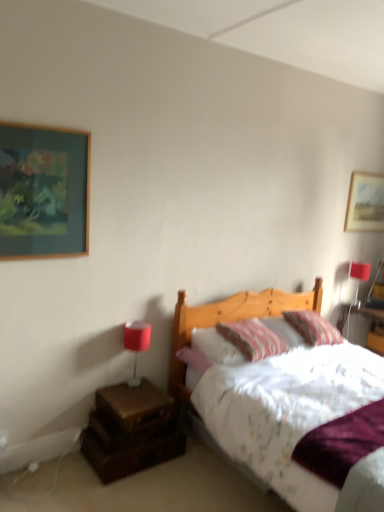
Find the location of `matte red lampshade at upper right, the 2th table lamp in the bottom-to-top sequence`. matte red lampshade at upper right, the 2th table lamp in the bottom-to-top sequence is located at coordinates (358, 278).

What do you see at coordinates (358, 278) in the screenshot?
I see `matte red lampshade at upper right, which is the 1th table lamp in top-to-bottom order` at bounding box center [358, 278].

Describe the element at coordinates (3, 439) in the screenshot. This screenshot has width=384, height=512. I see `white plastic electric outlet at lower left` at that location.

Find the location of a particular element. striped fabric pillow at center, marked as the 1th pillow in a left-to-right arrangement is located at coordinates (253, 339).

What do you see at coordinates (131, 430) in the screenshot?
I see `brown wooden nightstand at lower left` at bounding box center [131, 430].

The image size is (384, 512). Describe the element at coordinates (313, 328) in the screenshot. I see `striped fabric pillow at upper right, acting as the 1th pillow starting from the right` at that location.

What are the coordinates of `wooden picture frame at upper right, which ranks as the 2th picture frame in left-to-right order` in the screenshot? It's located at (365, 203).

Measure the distance between wooden picture frame at upper right, which ranks as the 2th picture frame in left-to-right order, and white plastic electric outlet at lower left.

wooden picture frame at upper right, which ranks as the 2th picture frame in left-to-right order, and white plastic electric outlet at lower left are 3.45 meters apart from each other.

Visually, is wooden picture frame at upper right, which is counted as the 1th picture frame, starting from the right, positioned to the left or to the right of white plastic electric outlet at lower left?

Clearly, wooden picture frame at upper right, which is counted as the 1th picture frame, starting from the right, is on the right of white plastic electric outlet at lower left in the image.

Considering the relative positions of wooden picture frame at upper right, the second picture frame from the front, and white plastic electric outlet at lower left in the image provided, is wooden picture frame at upper right, the second picture frame from the front, in front of white plastic electric outlet at lower left?

That is False.

From a real-world perspective, is wooden picture frame at upper right, which is counted as the 1th picture frame, starting from the right, physically located above or below white plastic electric outlet at lower left?

wooden picture frame at upper right, which is counted as the 1th picture frame, starting from the right, is situated higher than white plastic electric outlet at lower left in the real world.

Is wooden picture frame at upper left, the 1th picture frame positioned from the front, facing away from matte red table lamp at left, the 1th table lamp viewed from the front?

That's not correct — wooden picture frame at upper left, the 1th picture frame positioned from the front, is not looking away from matte red table lamp at left, the 1th table lamp viewed from the front.

This screenshot has width=384, height=512. There is a wooden picture frame at upper left, the 1th picture frame in the left-to-right sequence. Identify the location of the 2nd table lamp below it (from a real-world perspective). (136, 344).

How many degrees apart are the facing directions of wooden picture frame at upper left, the 1th picture frame positioned from the front, and matte red table lamp at left, the 2th table lamp viewed from the right?

There is a 0.531-degree angle between the facing directions of wooden picture frame at upper left, the 1th picture frame positioned from the front, and matte red table lamp at left, the 2th table lamp viewed from the right.

From a real-world perspective, is matte red lampshade at upper right, placed as the 1th table lamp when sorted from right to left, above or below matte red table lamp at left, the 1th table lamp viewed from the front?

Clearly, from a real-world perspective, matte red lampshade at upper right, placed as the 1th table lamp when sorted from right to left, is above matte red table lamp at left, the 1th table lamp viewed from the front.

Would you say matte red lampshade at upper right, which is the 1th table lamp in top-to-bottom order, is to the left or to the right of matte red table lamp at left, the 2th table lamp viewed from the right, in the picture?

From the image, it's evident that matte red lampshade at upper right, which is the 1th table lamp in top-to-bottom order, is to the right of matte red table lamp at left, the 2th table lamp viewed from the right.

Considering the sizes of objects wooden picture frame at upper left, which is the 2th picture frame from right to left, and wooden picture frame at upper right, which is the first picture frame in back-to-front order, in the image provided, who is taller, wooden picture frame at upper left, which is the 2th picture frame from right to left, or wooden picture frame at upper right, which is the first picture frame in back-to-front order,?

wooden picture frame at upper left, which is the 2th picture frame from right to left, is taller.

Consider the image. Which of these two, wooden picture frame at upper left, the 1th picture frame positioned from the front, or wooden picture frame at upper right, which is counted as the 1th picture frame, starting from the right, is bigger?

wooden picture frame at upper right, which is counted as the 1th picture frame, starting from the right, is bigger.

Is wooden picture frame at upper left, the 1th picture frame in the left-to-right sequence, further to camera compared to wooden picture frame at upper right, which is the first picture frame in back-to-front order?

No, the depth of wooden picture frame at upper left, the 1th picture frame in the left-to-right sequence, is less than that of wooden picture frame at upper right, which is the first picture frame in back-to-front order.

From the image's perspective, does wooden picture frame at upper left, which is the 2th picture frame from right to left, appear higher than wooden picture frame at upper right, which is counted as the 1th picture frame, starting from the right?

Actually, wooden picture frame at upper left, which is the 2th picture frame from right to left, appears below wooden picture frame at upper right, which is counted as the 1th picture frame, starting from the right, in the image.

Between matte red lampshade at upper right, the second table lamp viewed from the front, and striped fabric pillow at center, marked as the 1th pillow in a left-to-right arrangement, which one has less height?

striped fabric pillow at center, marked as the 1th pillow in a left-to-right arrangement, is shorter.

Visually, is matte red lampshade at upper right, the 2th table lamp in the bottom-to-top sequence, positioned to the left or to the right of striped fabric pillow at center, which appears as the second pillow when viewed from the right?

matte red lampshade at upper right, the 2th table lamp in the bottom-to-top sequence, is positioned on striped fabric pillow at center, which appears as the second pillow when viewed from the right,'s right side.

Does matte red lampshade at upper right, the 1th table lamp in the back-to-front sequence, turn towards striped fabric pillow at center, which appears as the second pillow when viewed from the right?

No, matte red lampshade at upper right, the 1th table lamp in the back-to-front sequence, is not facing towards striped fabric pillow at center, which appears as the second pillow when viewed from the right.

Where is `table lamp above the striped fabric pillow at center, which appears as the second pillow when viewed from the right (from the image's perspective)`? table lamp above the striped fabric pillow at center, which appears as the second pillow when viewed from the right (from the image's perspective) is located at coordinates (358, 278).

Would you consider brown wooden nightstand at lower left to be distant from matte red table lamp at left, which appears as the second table lamp when viewed from the back?

brown wooden nightstand at lower left is near matte red table lamp at left, which appears as the second table lamp when viewed from the back, not far away.

Can you confirm if brown wooden nightstand at lower left is wider than matte red table lamp at left, the 1th table lamp viewed from the front?

Indeed, brown wooden nightstand at lower left has a greater width compared to matte red table lamp at left, the 1th table lamp viewed from the front.

Considering the positions of objects brown wooden nightstand at lower left and matte red table lamp at left, which appears as the second table lamp when viewed from the back, in the image provided, who is more to the right, brown wooden nightstand at lower left or matte red table lamp at left, which appears as the second table lamp when viewed from the back,?

From the viewer's perspective, matte red table lamp at left, which appears as the second table lamp when viewed from the back, appears more on the right side.

From a real-world perspective, does striped fabric pillow at center, marked as the 1th pillow in a left-to-right arrangement, stand above brown wooden nightstand at lower left?

Yes.

Considering the points (283, 350) and (147, 388), which point is behind, point (283, 350) or point (147, 388)?

The point (283, 350) is more distant.

Where is `nightstand located underneath the striped fabric pillow at center, marked as the 1th pillow in a left-to-right arrangement (from a real-world perspective)`? The width and height of the screenshot is (384, 512). nightstand located underneath the striped fabric pillow at center, marked as the 1th pillow in a left-to-right arrangement (from a real-world perspective) is located at coordinates (131, 430).

Is striped fabric pillow at center, which appears as the second pillow when viewed from the right, looking in the opposite direction of brown wooden nightstand at lower left?

No.

Locate an element on the screen. Image resolution: width=384 pixels, height=512 pixels. picture frame that is behind the white plastic electric outlet at lower left is located at coordinates (365, 203).

The width and height of the screenshot is (384, 512). What are the coordinates of `picture frame in front of the matte red table lamp at left, positioned as the 1th table lamp in bottom-to-top order` in the screenshot? It's located at (43, 191).

Estimate the real-world distances between objects in this image. Which object is further from brown wooden nightstand at lower left, matte red table lamp at left, positioned as the 1th table lamp in bottom-to-top order, or white plastic electric outlet at lower left?

white plastic electric outlet at lower left is positioned further to the anchor brown wooden nightstand at lower left.

Estimate the real-world distances between objects in this image. Which object is closer to striped fabric pillow at center, which appears as the second pillow when viewed from the right, wooden picture frame at upper right, which ranks as the 2th picture frame in left-to-right order, or matte red table lamp at left, the 2th table lamp viewed from the right?

Based on the image, matte red table lamp at left, the 2th table lamp viewed from the right, appears to be nearer to striped fabric pillow at center, which appears as the second pillow when viewed from the right.

Based on the photo, based on their spatial positions, is striped fabric pillow at upper right, the second pillow positioned from the left, or matte red lampshade at upper right, placed as the 1th table lamp when sorted from right to left, closer to striped fabric pillow at center, which appears as the second pillow when viewed from the right?

striped fabric pillow at upper right, the second pillow positioned from the left, is closer to striped fabric pillow at center, which appears as the second pillow when viewed from the right.

Estimate the real-world distances between objects in this image. Which object is closer to brown wooden nightstand at lower left, wooden picture frame at upper left, the 2th picture frame when ordered from back to front, or striped fabric pillow at upper right, the second pillow positioned from the left?

wooden picture frame at upper left, the 2th picture frame when ordered from back to front, lies closer to brown wooden nightstand at lower left than the other object.

From the image, which object appears to be farther from wooden picture frame at upper right, the second picture frame from the front, matte red table lamp at left, the 1th table lamp when ordered from left to right, or matte red lampshade at upper right, the 1th table lamp in the back-to-front sequence?

matte red table lamp at left, the 1th table lamp when ordered from left to right, is positioned further to the anchor wooden picture frame at upper right, the second picture frame from the front.

When comparing their distances from striped fabric pillow at upper right, the second pillow positioned from the left, does white plastic electric outlet at lower left or wooden picture frame at upper left, the 1th picture frame in the left-to-right sequence, seem further?

white plastic electric outlet at lower left is positioned further to the anchor striped fabric pillow at upper right, the second pillow positioned from the left.

Looking at the image, which one is located closer to striped fabric pillow at center, marked as the 1th pillow in a left-to-right arrangement, striped fabric pillow at upper right, acting as the 1th pillow starting from the right, or white plastic electric outlet at lower left?

striped fabric pillow at upper right, acting as the 1th pillow starting from the right, is positioned closer to the anchor striped fabric pillow at center, marked as the 1th pillow in a left-to-right arrangement.

Estimate the real-world distances between objects in this image. Which object is further from white plastic electric outlet at lower left, brown wooden nightstand at lower left or wooden picture frame at upper left, the 2th picture frame when ordered from back to front?

wooden picture frame at upper left, the 2th picture frame when ordered from back to front, lies further to white plastic electric outlet at lower left than the other object.

Find the location of `table lamp located between brown wooden nightstand at lower left and striped fabric pillow at center, which appears as the second pillow when viewed from the right, in the left-right direction`. table lamp located between brown wooden nightstand at lower left and striped fabric pillow at center, which appears as the second pillow when viewed from the right, in the left-right direction is located at coordinates (136, 344).

Where is `nightstand between wooden picture frame at upper left, the 1th picture frame in the left-to-right sequence, and matte red lampshade at upper right, the 1th table lamp in the back-to-front sequence`? nightstand between wooden picture frame at upper left, the 1th picture frame in the left-to-right sequence, and matte red lampshade at upper right, the 1th table lamp in the back-to-front sequence is located at coordinates (131, 430).

Locate an element on the screen. Image resolution: width=384 pixels, height=512 pixels. picture frame between white plastic electric outlet at lower left and wooden picture frame at upper right, the second picture frame from the front, in the horizontal direction is located at coordinates (43, 191).

At what (x,y) coordinates should I click in order to perform the action: click on nightstand situated between white plastic electric outlet at lower left and matte red table lamp at left, the 1th table lamp when ordered from left to right, from left to right. Please return your answer as a coordinate pair (x, y). Looking at the image, I should click on (131, 430).